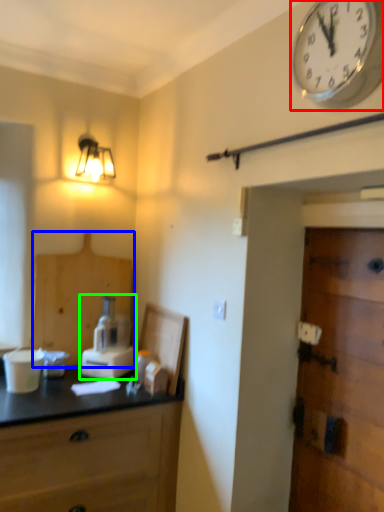
Question: Which object is the farthest from wall clock (highlighted by a red box)? Choose among these: cabinetry (highlighted by a blue box) or blender (highlighted by a green box).

Choices:
 (A) cabinetry
 (B) blender

Answer: (A)